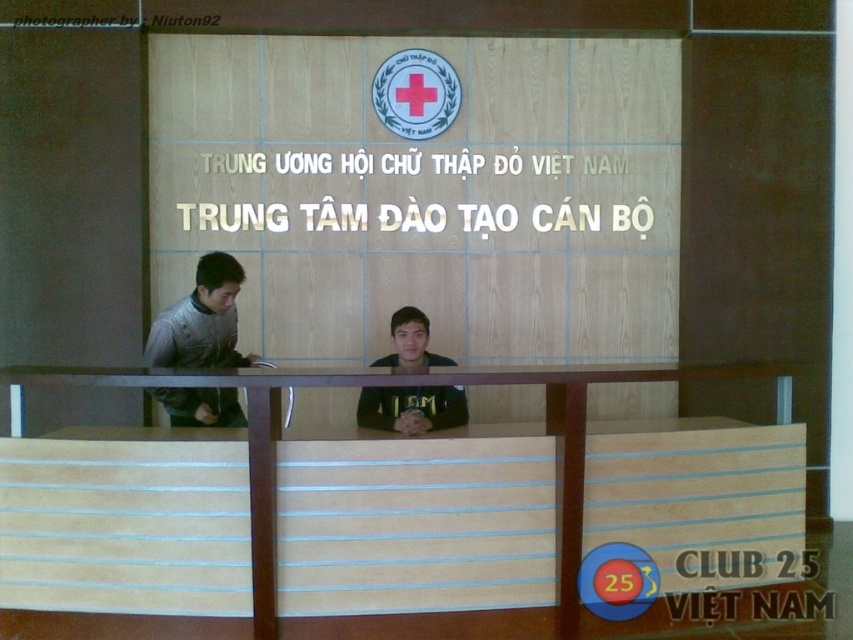
You are standing in the reception area of the Vietnam Red Cross Training Center. You notice two points marked on the floor. The first point is at coordinates point (553, 365) and the second point is at point (212, 394). Which point is closer to the wooden panel with the Vietnam Red Cross emblem?

Point (212, 394) is closer to the wooden panel with the Vietnam Red Cross emblem because it is in front of point (553, 365), which is behind it.

You are standing in the reception area of the Vietnam Red Cross Training Center. You need to place a 1.5 meter long banner on the light brown wood table at center. Can you fit the banner on the table?

The light brown wood table at center is 3.59 meters away from the camera, but the question is about the table length. Since the table length isn not provided in the description, we cannot determine if the banner will fit. Please check the table dimensions.